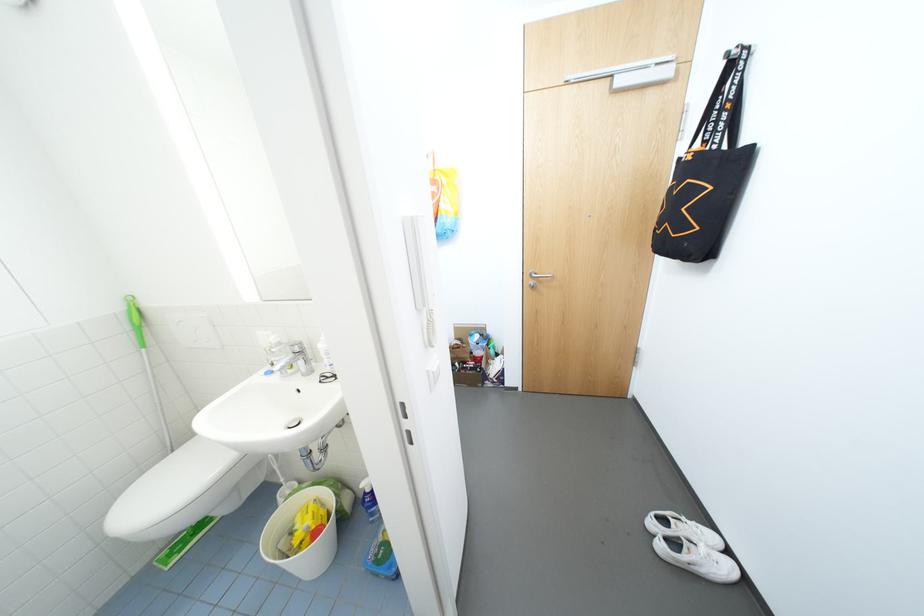
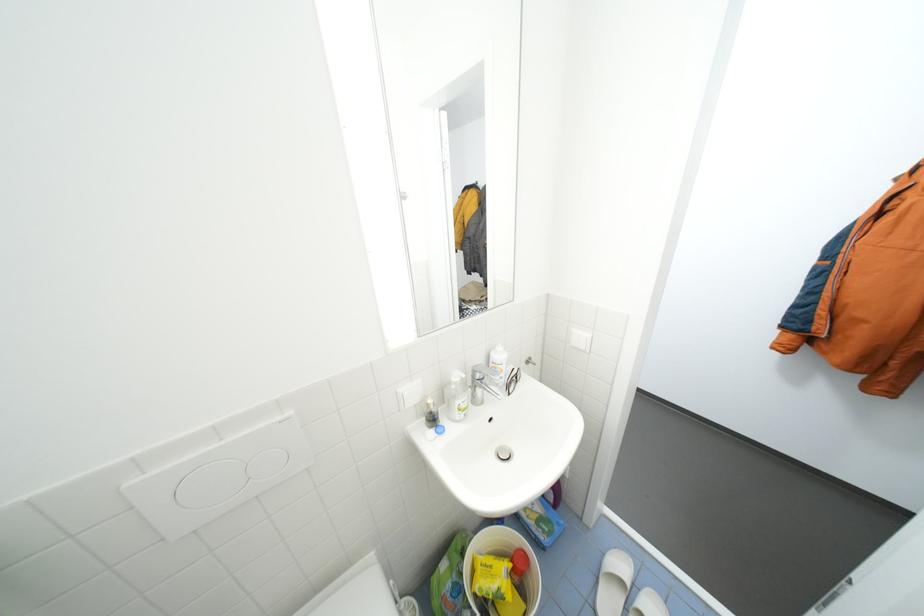
Question: I am providing you with two images of the same scene from different viewpoints. Which of the following objects are not visible in image2?

Choices:
 (A) red bottle cap
 (B) small flush button
 (C) blue spray bottle
 (D) green tissue package

Answer: (C)